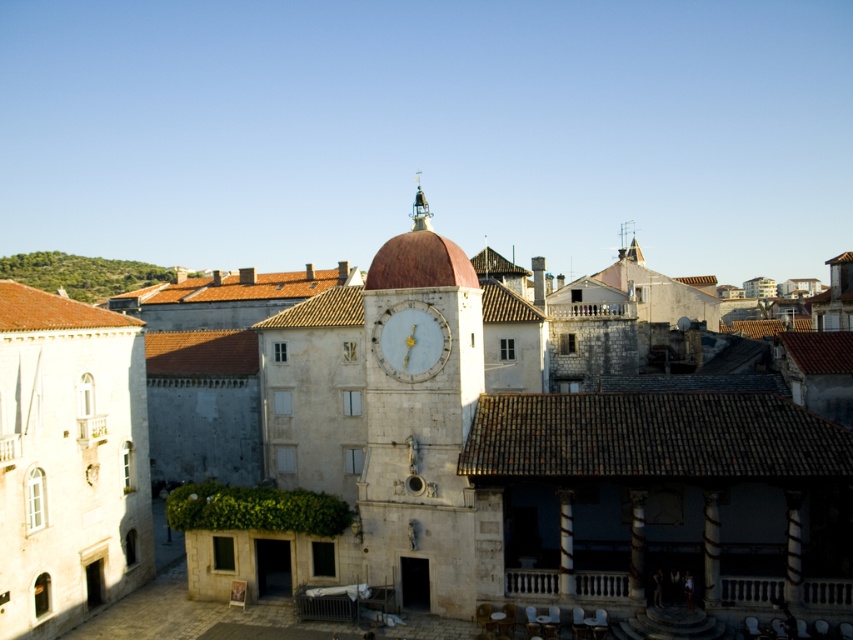
You are standing in the historic town square and looking at the clock tower. There are two points marked in the image. The first point is at coordinates point (263, 588) and the second is at point (425, 369). Which point is closer to you?

Point (263, 588) is further to the camera than point (425, 369), so the second point is closer to you.

You are standing in the historic European town square and want to take a photo of the white stone clock tower at center. The camera you are using has a focal length of 50mm and a sensor size of 24mm x 36mm. To ensure the entire tower fits in the frame, what is the minimum distance you should maintain from the tower?

The white stone clock tower at center is 32.85 meters away from viewer. To ensure the entire tower fits in the frame, you should maintain a distance of at least 32.85 meters.

You are an architect visiting the town square and notice two clocks. The first is the white stone clock tower at center, and the second is the light blue marble clock at center. Which one do you think is bigger in size?

The white stone clock tower at center has a larger size compared to the light blue marble clock at center, so the white stone clock tower at center is bigger.